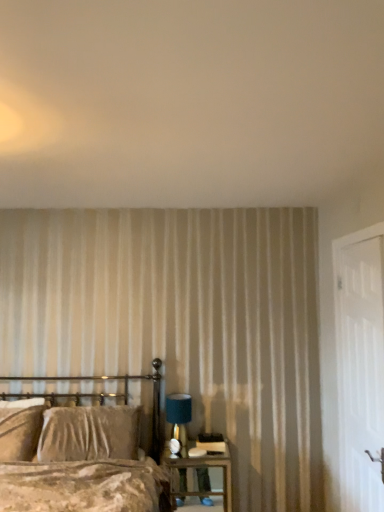
Question: Considering the relative sizes of teal fabric lampshade at right and wooden nightstand at lower right in the image provided, is teal fabric lampshade at right wider than wooden nightstand at lower right?

Choices:
 (A) no
 (B) yes

Answer: (A)

Question: Would you say wooden nightstand at lower right is part of teal fabric lampshade at right's contents?

Choices:
 (A) yes
 (B) no

Answer: (B)

Question: From a real-world perspective, is teal fabric lampshade at right positioned over wooden nightstand at lower right based on gravity?

Choices:
 (A) no
 (B) yes

Answer: (B)

Question: Does teal fabric lampshade at right lie in front of wooden nightstand at lower right?

Choices:
 (A) no
 (B) yes

Answer: (A)

Question: Is teal fabric lampshade at right not near wooden nightstand at lower right?

Choices:
 (A) no
 (B) yes

Answer: (A)

Question: Is teal fabric lampshade at right inside the boundaries of wooden nightstand at lower right, or outside?

Choices:
 (A) outside
 (B) inside

Answer: (A)

Question: Is teal fabric lampshade at right in front of or behind wooden nightstand at lower right in the image?

Choices:
 (A) front
 (B) behind

Answer: (B)

Question: Based on their sizes in the image, would you say teal fabric lampshade at right is bigger or smaller than wooden nightstand at lower right?

Choices:
 (A) small
 (B) big

Answer: (A)

Question: Would you say teal fabric lampshade at right is to the left or to the right of wooden nightstand at lower right in the picture?

Choices:
 (A) right
 (B) left

Answer: (B)

Question: Is velvet beige pillow at left to the left or to the right of white wooden door at right in the image?

Choices:
 (A) left
 (B) right

Answer: (A)

Question: Is velvet beige pillow at left inside or outside of white wooden door at right?

Choices:
 (A) inside
 (B) outside

Answer: (B)

Question: Based on their sizes in the image, would you say velvet beige pillow at left is bigger or smaller than white wooden door at right?

Choices:
 (A) big
 (B) small

Answer: (A)

Question: From the image's perspective, is velvet beige pillow at left above or below white wooden door at right?

Choices:
 (A) above
 (B) below

Answer: (B)

Question: Is velvet brown bed at lower left wider or thinner than white textured wall at upper center?

Choices:
 (A) wide
 (B) thin

Answer: (B)

Question: From their relative heights in the image, would you say velvet brown bed at lower left is taller or shorter than white textured wall at upper center?

Choices:
 (A) tall
 (B) short

Answer: (A)